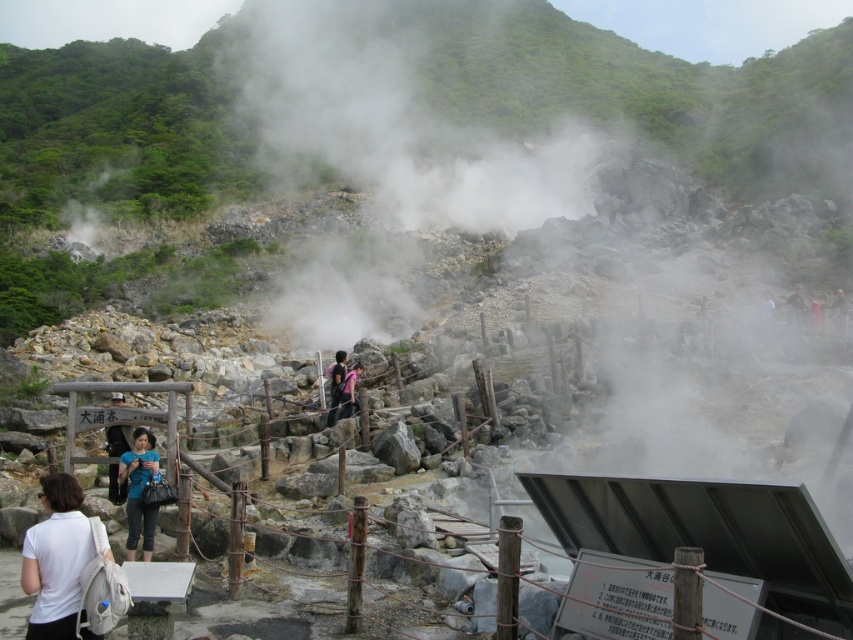
Can you confirm if matte black shirt at center is positioned above dark green fabric jacket at upper right?

No, matte black shirt at center is not above dark green fabric jacket at upper right.

At what (x,y) coordinates should I click in order to perform the action: click on matte black shirt at center. Please return your answer as a coordinate pair (x, y). The height and width of the screenshot is (640, 853). Looking at the image, I should click on click(x=115, y=440).

Is matte black shirt at center shorter than dark blue shirt at center?

In fact, matte black shirt at center may be taller than dark blue shirt at center.

The width and height of the screenshot is (853, 640). What are the coordinates of `matte black shirt at center` in the screenshot? It's located at (115, 440).

In order to click on matte black shirt at center in this screenshot , I will do `click(115, 440)`.

In the scene shown: Can you confirm if matte black shirt at center is positioned to the right of dark blue backpack at center?

No, matte black shirt at center is not to the right of dark blue backpack at center.

What do you see at coordinates (115, 440) in the screenshot? The image size is (853, 640). I see `matte black shirt at center` at bounding box center [115, 440].

Where is `matte black shirt at center`? This screenshot has width=853, height=640. matte black shirt at center is located at coordinates (115, 440).